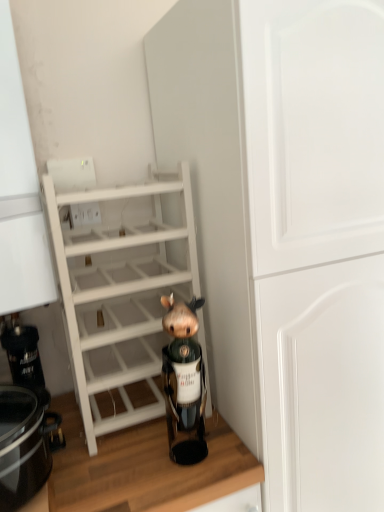
I want to click on vacant region in front of brown matte figurine at center, so click(182, 488).